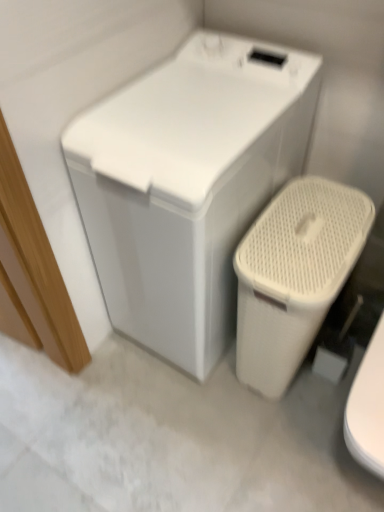
Find the location of a particular element. The height and width of the screenshot is (512, 384). free space above beige textured plastic toilet at lower right (from a real-world perspective) is located at coordinates (309, 234).